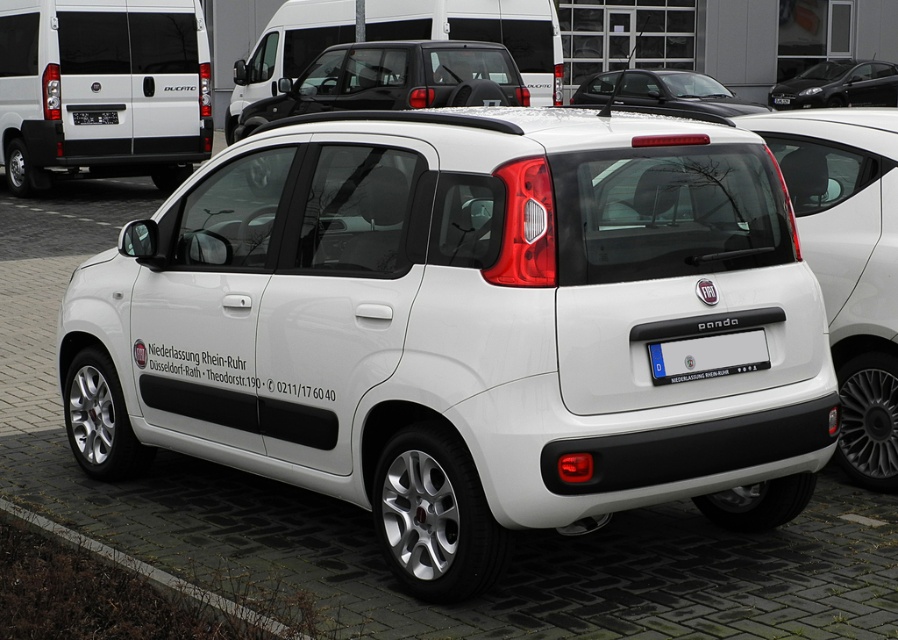
Question: Which point appears farthest from the camera in this image?

Choices:
 (A) (516, 61)
 (B) (678, 339)

Answer: (A)

Question: In this image, where is white matte car at center located relative to white matte minivan at center?

Choices:
 (A) below
 (B) above

Answer: (A)

Question: Considering the real-world distances, which object is farthest from the gray concrete curb at lower left?

Choices:
 (A) white matte car at center
 (B) white matte minivan at center
 (C) blue plastic license plate at rear

Answer: (B)

Question: Is white matte van at upper left positioned at the back of white matte minivan at center?

Choices:
 (A) no
 (B) yes

Answer: (A)

Question: Can you confirm if white matte van at center is positioned below white matte minivan at center?

Choices:
 (A) yes
 (B) no

Answer: (B)

Question: Which point is closer to the camera taking this photo?

Choices:
 (A) (877, 99)
 (B) (315, 444)
 (C) (93, 124)

Answer: (B)